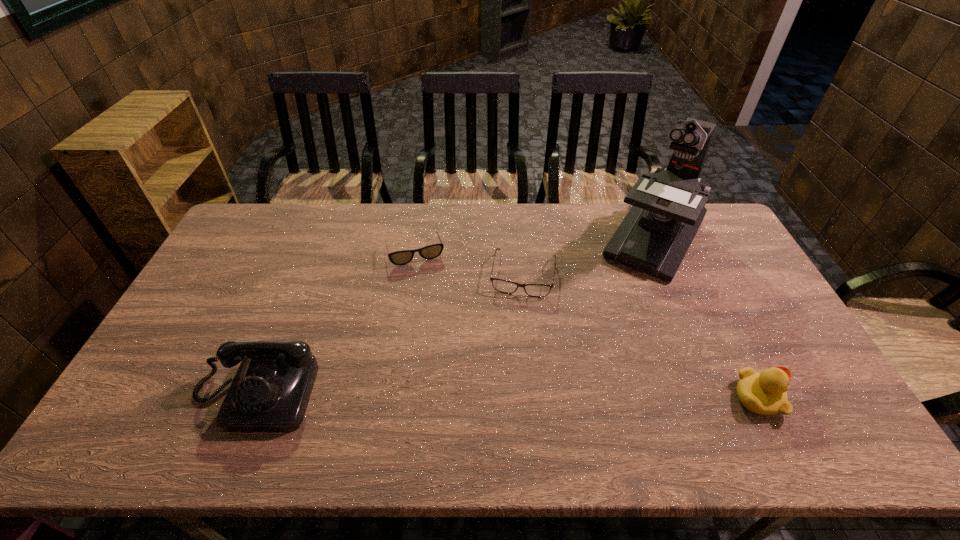
Identify the location of the fourth shortest object. (270, 391).

Where is `telephone`? telephone is located at coordinates (270, 391).

Image resolution: width=960 pixels, height=540 pixels. Identify the location of the third tallest object. (764, 393).

Locate an element on the screen. spectacles is located at coordinates (535, 290).

Locate an element on the screen. The height and width of the screenshot is (540, 960). microscope is located at coordinates (668, 208).

The width and height of the screenshot is (960, 540). I want to click on the second object from left to right, so click(403, 257).

Find the location of a particular element. free location located 0.100m on the front-facing side of the duckling is located at coordinates (822, 397).

Where is `free space located 0.330m on the lenses of the third object from right to left`? Image resolution: width=960 pixels, height=540 pixels. free space located 0.330m on the lenses of the third object from right to left is located at coordinates (505, 392).

What are the coordinates of `free space located on the lenses of the third object from right to left` in the screenshot? It's located at (515, 328).

Where is `vacant space located on the lenses of the third object from right to left`? The image size is (960, 540). vacant space located on the lenses of the third object from right to left is located at coordinates (503, 402).